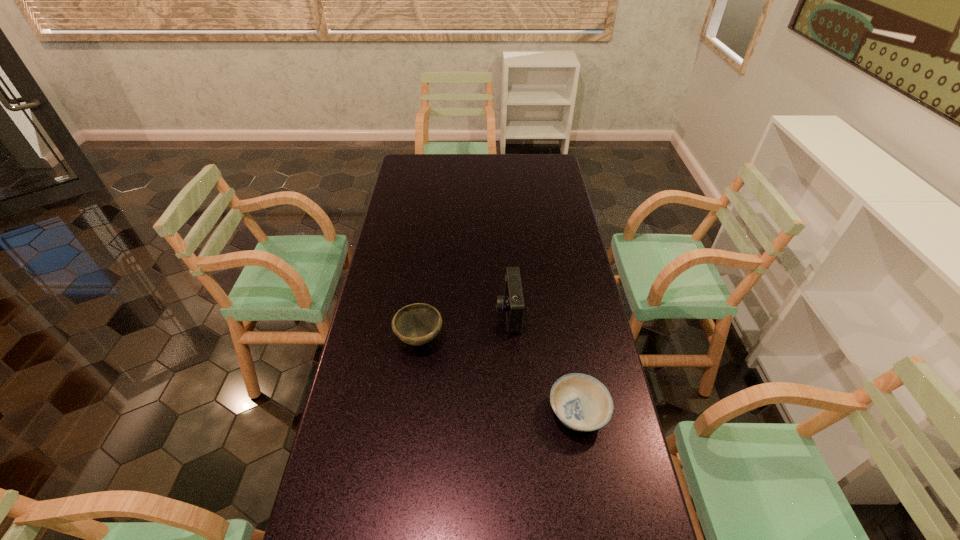
Find the location of a particular element. Image resolution: width=960 pixels, height=540 pixels. camera is located at coordinates pyautogui.click(x=512, y=302).

At what (x,y) coordinates should I click in order to perform the action: click on the tallest object. Please return your answer as a coordinate pair (x, y). This screenshot has height=540, width=960. Looking at the image, I should click on (512, 302).

Find the location of `the leftmost object`. the leftmost object is located at coordinates (416, 324).

This screenshot has width=960, height=540. Identify the location of the taller bowl. (416, 324).

Find the location of a particular element. the shorter bowl is located at coordinates (581, 402).

Where is `the nearer bowl`? The width and height of the screenshot is (960, 540). the nearer bowl is located at coordinates (581, 402).

Image resolution: width=960 pixels, height=540 pixels. What are the coordinates of `free space located 0.280m on the front-facing side of the camera` in the screenshot? It's located at (413, 312).

Find the location of `free space located on the front-facing side of the camera`. free space located on the front-facing side of the camera is located at coordinates (389, 312).

Image resolution: width=960 pixels, height=540 pixels. Find the location of `blank space located 0.060m on the front-facing side of the camera`. blank space located 0.060m on the front-facing side of the camera is located at coordinates (478, 312).

The image size is (960, 540). I want to click on free space located on the back of the left bowl, so click(x=424, y=301).